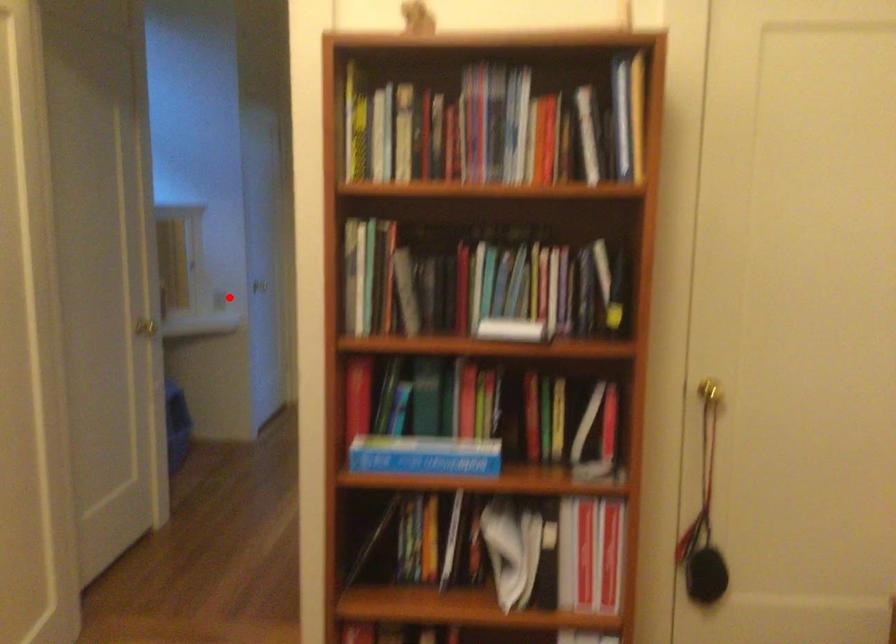
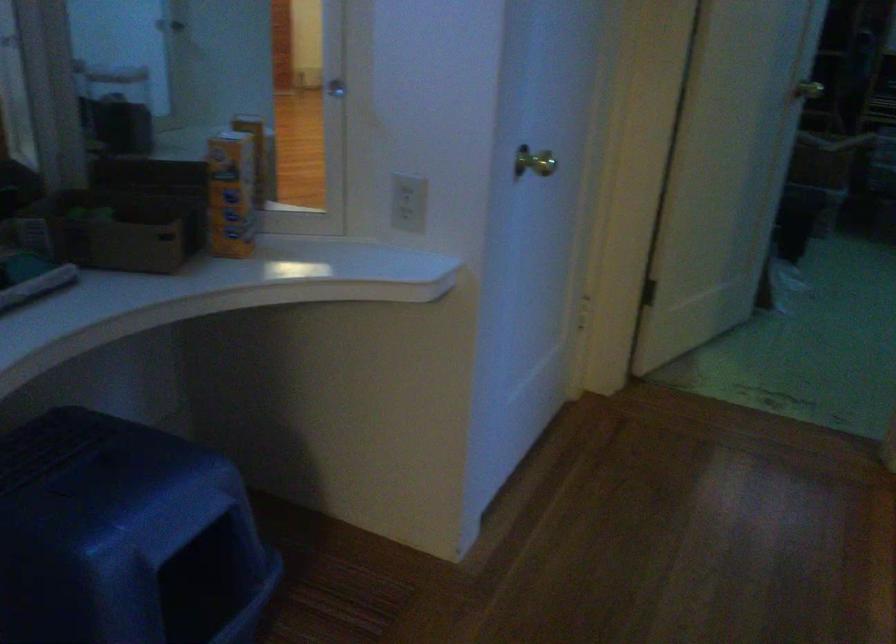
Question: I am providing you with two images of the same scene from different viewpoints. Given a red point in image1, look at the same physical point in image2. Is it:

Choices:
 (A) Closer to the viewpoint
 (B) Farther from the viewpoint

Answer: (A)